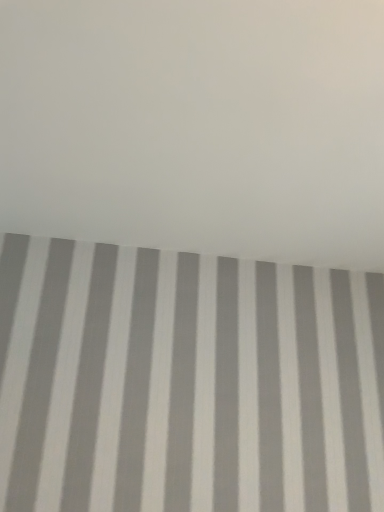
Describe the element at coordinates (197, 126) in the screenshot. I see `white striped fabric at bottom` at that location.

Image resolution: width=384 pixels, height=512 pixels. I want to click on white striped fabric at bottom, so click(x=197, y=126).

At what (x,y) coordinates should I click in order to perform the action: click on white striped fabric at bottom. Please return your answer as a coordinate pair (x, y). The height and width of the screenshot is (512, 384). Looking at the image, I should click on (197, 126).